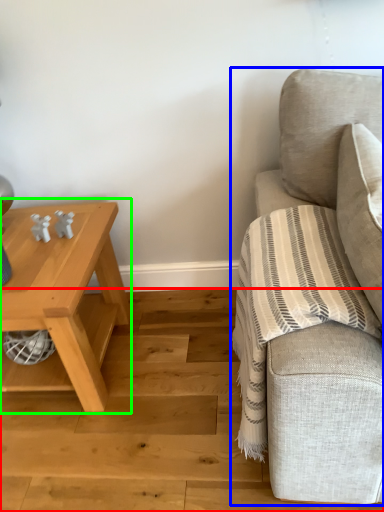
Question: Which is farther away from stair (highlighted by a red box)? studio couch (highlighted by a blue box) or table (highlighted by a green box)?

Choices:
 (A) studio couch
 (B) table

Answer: (A)